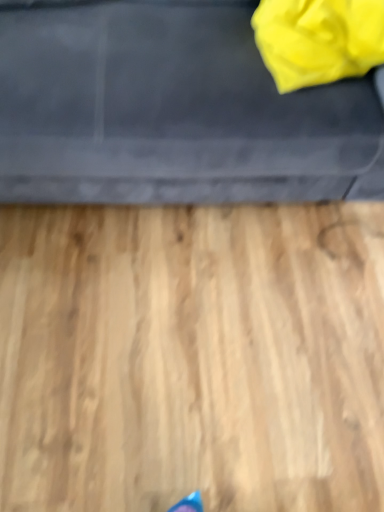
Question: Does matte black sofa at upper center lie in front of yellow fabric bag at upper right?

Choices:
 (A) no
 (B) yes

Answer: (B)

Question: Could you tell me if matte black sofa at upper center is facing yellow fabric bag at upper right?

Choices:
 (A) no
 (B) yes

Answer: (B)

Question: Is matte black sofa at upper center oriented away from yellow fabric bag at upper right?

Choices:
 (A) yes
 (B) no

Answer: (A)

Question: Does matte black sofa at upper center have a lesser height compared to yellow fabric bag at upper right?

Choices:
 (A) yes
 (B) no

Answer: (B)

Question: Can you confirm if matte black sofa at upper center is smaller than yellow fabric bag at upper right?

Choices:
 (A) no
 (B) yes

Answer: (A)

Question: Are matte black sofa at upper center and yellow fabric bag at upper right located far from each other?

Choices:
 (A) no
 (B) yes

Answer: (A)

Question: Can you confirm if yellow fabric bag at upper right is taller than matte black sofa at upper center?

Choices:
 (A) no
 (B) yes

Answer: (A)

Question: Is yellow fabric bag at upper right not close to matte black sofa at upper center?

Choices:
 (A) no
 (B) yes

Answer: (A)

Question: From the image's perspective, is yellow fabric bag at upper right beneath matte black sofa at upper center?

Choices:
 (A) yes
 (B) no

Answer: (A)

Question: From a real-world perspective, does yellow fabric bag at upper right sit lower than matte black sofa at upper center?

Choices:
 (A) no
 (B) yes

Answer: (A)

Question: Can you confirm if yellow fabric bag at upper right is positioned to the right of matte black sofa at upper center?

Choices:
 (A) yes
 (B) no

Answer: (A)

Question: From a real-world perspective, is yellow fabric bag at upper right on matte black sofa at upper center?

Choices:
 (A) no
 (B) yes

Answer: (B)

Question: Based on their sizes in the image, would you say yellow fabric bag at upper right is bigger or smaller than matte black sofa at upper center?

Choices:
 (A) small
 (B) big

Answer: (A)